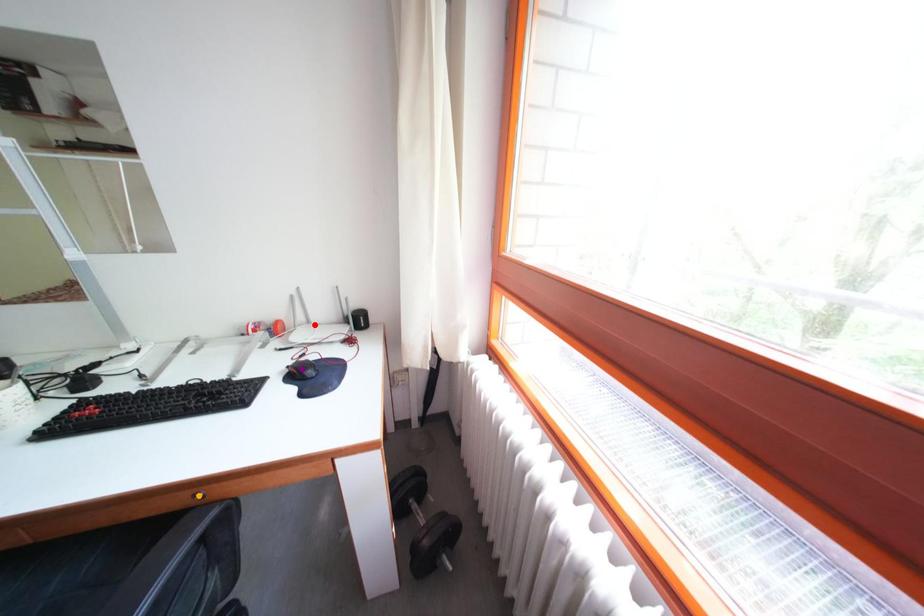
Order these from farthest to nearest:
1. red point
2. orange point
3. purple point

red point < purple point < orange point